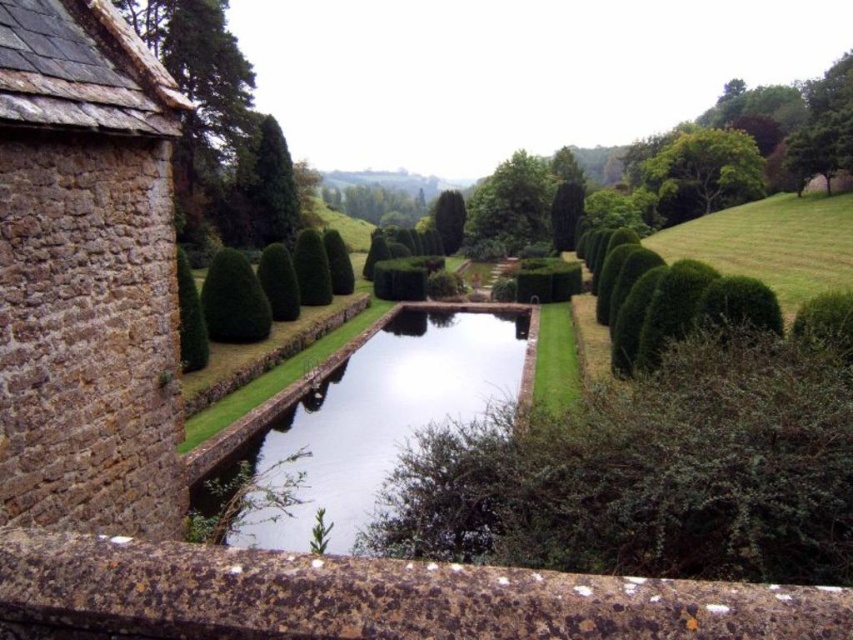
Question: Based on their relative distances, which object is nearer to the green leafy tree at upper right?

Choices:
 (A) clear water at center
 (B) green leafy bush at center

Answer: (A)

Question: Can you confirm if green leafy tree at center is positioned above green leafy bush at center?

Choices:
 (A) no
 (B) yes

Answer: (B)

Question: Considering the relative positions of green leafy tree at upper right and green textured hedge at center in the image provided, where is green leafy tree at upper right located with respect to green textured hedge at center?

Choices:
 (A) right
 (B) left

Answer: (A)

Question: Which point appears farthest from the camera in this image?

Choices:
 (A) (196, 321)
 (B) (254, 276)
 (C) (550, 180)

Answer: (C)

Question: Does green leafy tree at upper right lie in front of green textured hedge at center?

Choices:
 (A) no
 (B) yes

Answer: (A)

Question: Which of these objects is positioned closest to the clear water at center?

Choices:
 (A) green leafy bush at center
 (B) green leafy tree at upper right
 (C) green textured hedge at center
 (D) green leafy tree at center

Answer: (A)